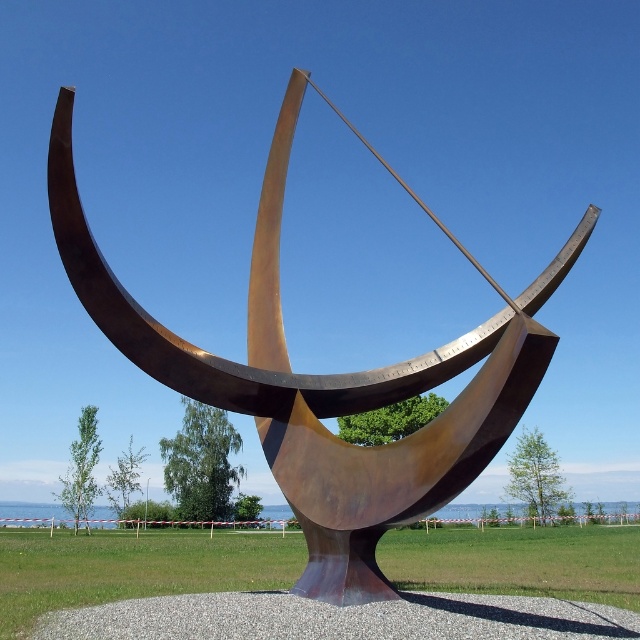
You are standing in front of the sculpture and notice two points marked on it. The first point is at coordinates point (64, 90) and the second is at point (273, 609). If you want to touch the point that is closer to you, which one should you reach for?

You should reach for point (64, 90) because it is closer to the camera than point (273, 609).

You are a landscape architect designing a garden around the sculpture. You need to place a small decorative fountain that must be shorter than the rusty metal sundial at center but taller than the gray gravel at center. Is this possible?

The rusty metal sundial at center is much taller than the gray gravel at center, so there is a height range between them. Therefore, the fountain can be placed as it can be shorter than the sundial but taller than the gravel.